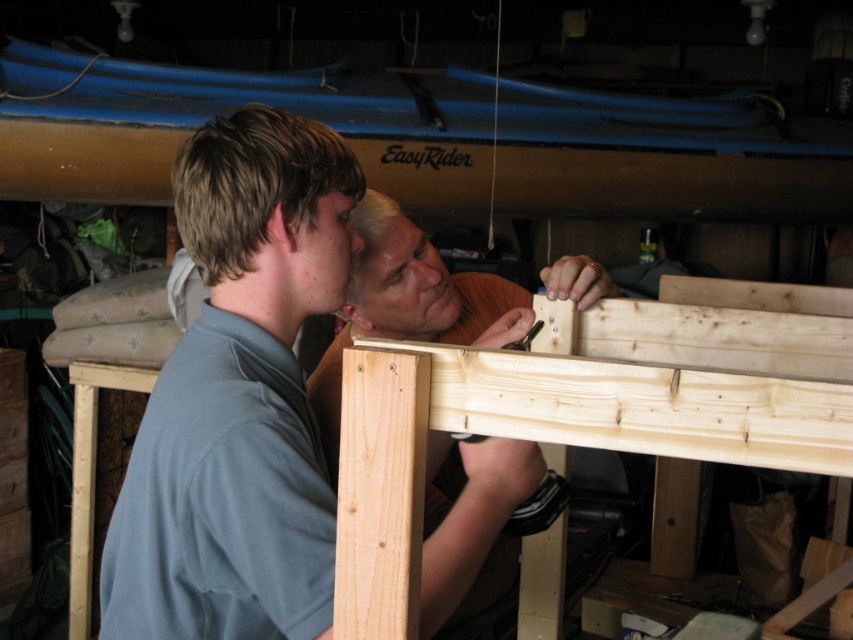
Question: Which point appears closest to the camera in this image?

Choices:
 (A) (292, 115)
 (B) (440, 528)

Answer: (B)

Question: Where is light blue shirt at center located in relation to natural wood plank at center in the image?

Choices:
 (A) above
 (B) below

Answer: (A)

Question: Which of the following is the closest to the observer?

Choices:
 (A) (500, 497)
 (B) (486, 477)

Answer: (B)

Question: Is light blue shirt at center thinner than natural wood plank at center?

Choices:
 (A) yes
 (B) no

Answer: (B)

Question: Can you confirm if light blue shirt at center is wider than natural wood plank at center?

Choices:
 (A) yes
 (B) no

Answer: (A)